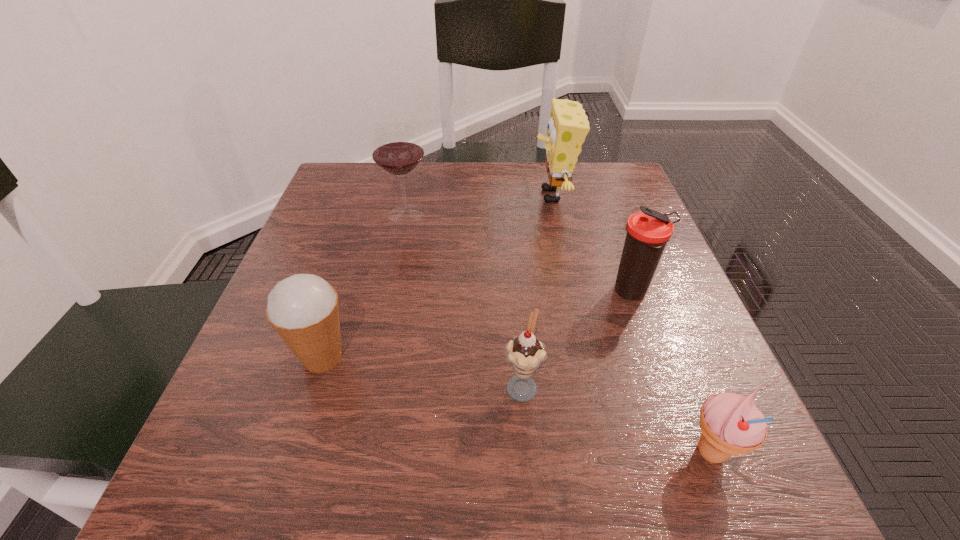
Find the location of `vacant space at the far left corner of the desktop`. vacant space at the far left corner of the desktop is located at coordinates [374, 177].

Locate an element on the screen. free space at the near left corner of the desktop is located at coordinates (223, 483).

At what (x,y) coordinates should I click in order to perform the action: click on vacant space at the far right corner. Please return your answer as a coordinate pair (x, y). The image size is (960, 540). Looking at the image, I should click on (587, 172).

Locate an element on the screen. This screenshot has height=540, width=960. vacant position at the near right corner of the desktop is located at coordinates (715, 491).

Image resolution: width=960 pixels, height=540 pixels. Find the location of `free space between the nearest icecream and the wineglass`. free space between the nearest icecream and the wineglass is located at coordinates (559, 333).

Locate an element on the screen. vacant area that lies between the wineglass and the fourth nearest object is located at coordinates (519, 253).

Image resolution: width=960 pixels, height=540 pixels. Identify the location of free spot between the fourth nearest object and the wineglass. (519, 253).

Find the location of a particular element. vacant area that lies between the sponge and the nearest icecream is located at coordinates (632, 324).

You are a GUI agent. You are given a task and a screenshot of the screen. Output one action in this format:
    pyautogui.click(x=<x>, y=<y>)
    Task: Click on the empty location between the sponge and the leftmost icecream
    The image size is (960, 540).
    Given the screenshot: What is the action you would take?
    pyautogui.click(x=438, y=276)

You are a GUI agent. You are given a task and a screenshot of the screen. Output one action in this format:
    pyautogui.click(x=<x>, y=<y>)
    Task: Click on the free spot between the leftmost icecream and the fourth object from right to left
    The height and width of the screenshot is (540, 960).
    Given the screenshot: What is the action you would take?
    pyautogui.click(x=422, y=370)